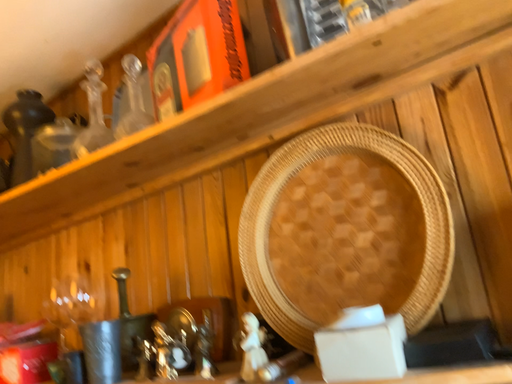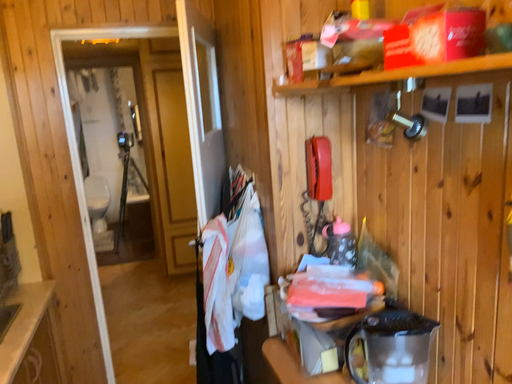
Question: Which way did the camera rotate in the video?

Choices:
 (A) rotated left
 (B) rotated right

Answer: (A)